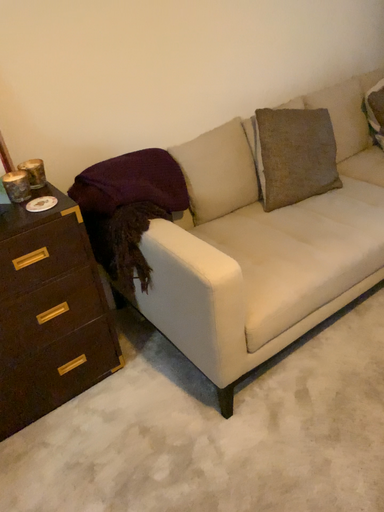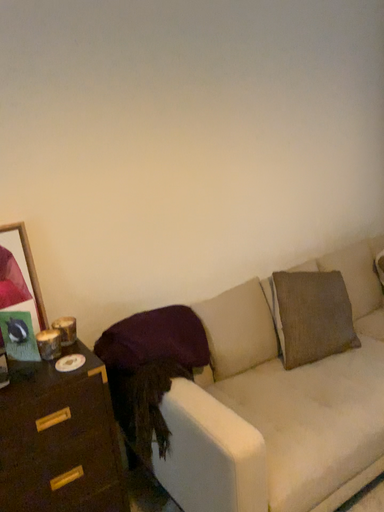
Question: Which way did the camera rotate in the video?

Choices:
 (A) rotated downward
 (B) rotated upward

Answer: (B)